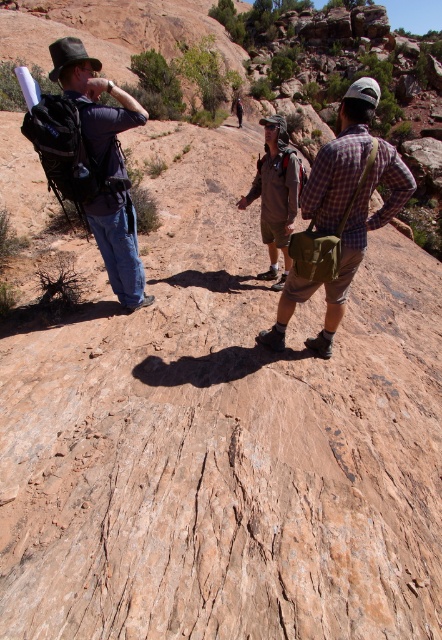
Is plaid cotton shirt at center above matte black backpack at left?

Yes, plaid cotton shirt at center is above matte black backpack at left.

Does point (376, 152) come farther from viewer compared to point (125, 298)?

That is False.

Where is `plaid cotton shirt at center`? Image resolution: width=442 pixels, height=640 pixels. plaid cotton shirt at center is located at coordinates (339, 214).

Does plaid cotton shirt at center appear on the left side of brown suede jacket at center?

No, plaid cotton shirt at center is not to the left of brown suede jacket at center.

Looking at this image, how far apart are plaid cotton shirt at center and brown suede jacket at center?

They are 5.48 feet apart.

Is point (404, 189) positioned behind point (281, 211)?

That is False.

Image resolution: width=442 pixels, height=640 pixels. Find the location of `plaid cotton shirt at center`. plaid cotton shirt at center is located at coordinates (339, 214).

Is matte black backpack at left closer to the viewer compared to brown suede jacket at center?

Yes, matte black backpack at left is closer to the viewer.

The height and width of the screenshot is (640, 442). Identify the location of matte black backpack at left. (105, 164).